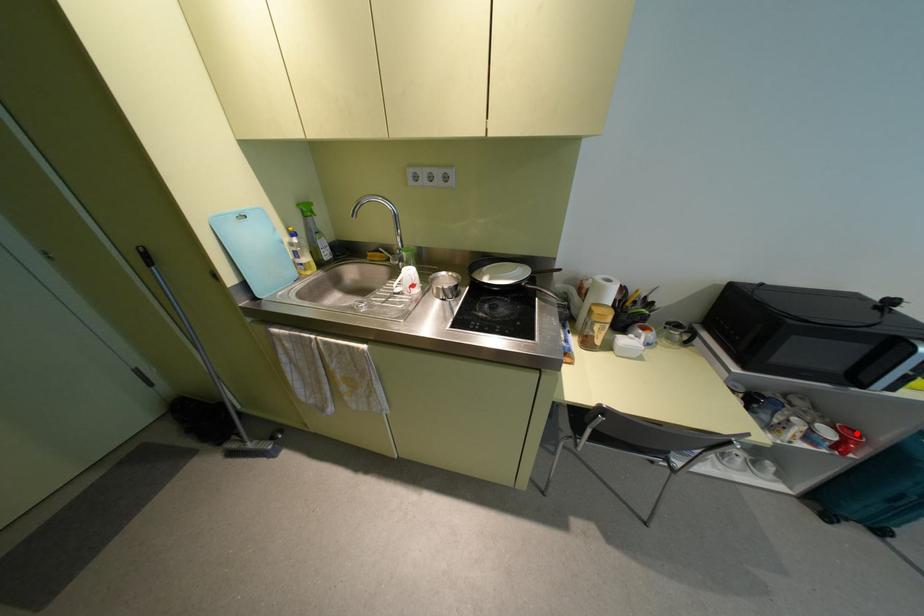
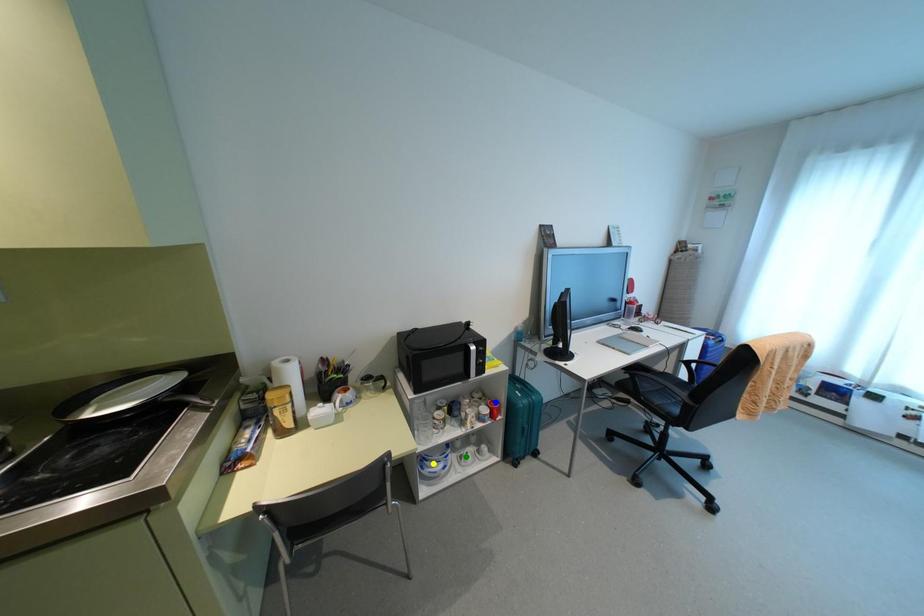
Question: I am providing you with two images of the same scene from different viewpoints. A red point is marked on the first image. You are given multiple points on the second image. Which mark in image 2 goes with the point in image 1?

Choices:
 (A) green point
 (B) blue point
 (C) yellow point

Answer: (B)